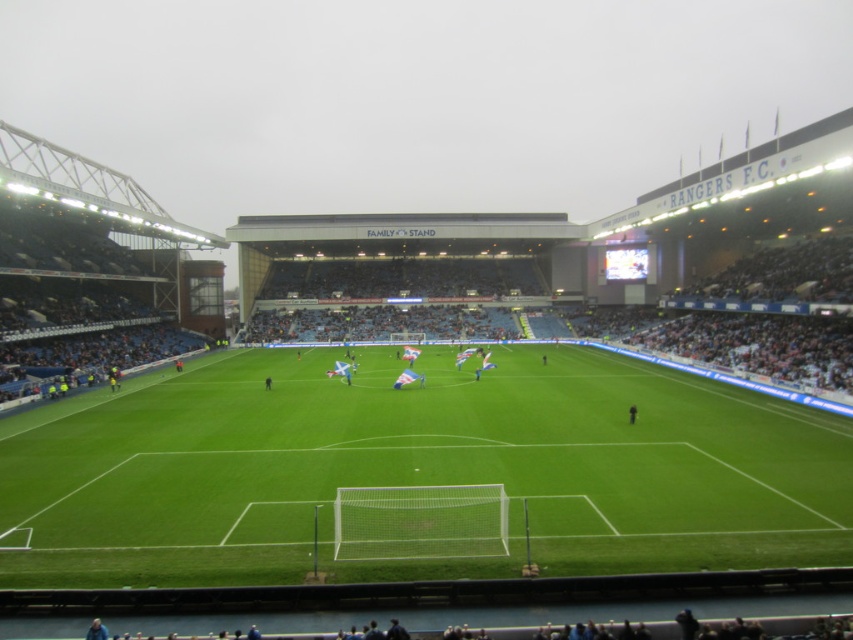
Question: Which point appears closest to the camera in this image?

Choices:
 (A) (648, 522)
 (B) (635, 419)

Answer: (A)

Question: In this image, where is green grass football field at center located relative to black fabric person at center?

Choices:
 (A) right
 (B) left

Answer: (B)

Question: Which of the following is the farthest from the observer?

Choices:
 (A) green grass football field at center
 (B) black fabric person at center

Answer: (B)

Question: Can you confirm if green grass football field at center is positioned below black fabric person at center?

Choices:
 (A) no
 (B) yes

Answer: (A)

Question: Observing the image, what is the correct spatial positioning of green grass football field at center in reference to black fabric person at center?

Choices:
 (A) left
 (B) right

Answer: (A)